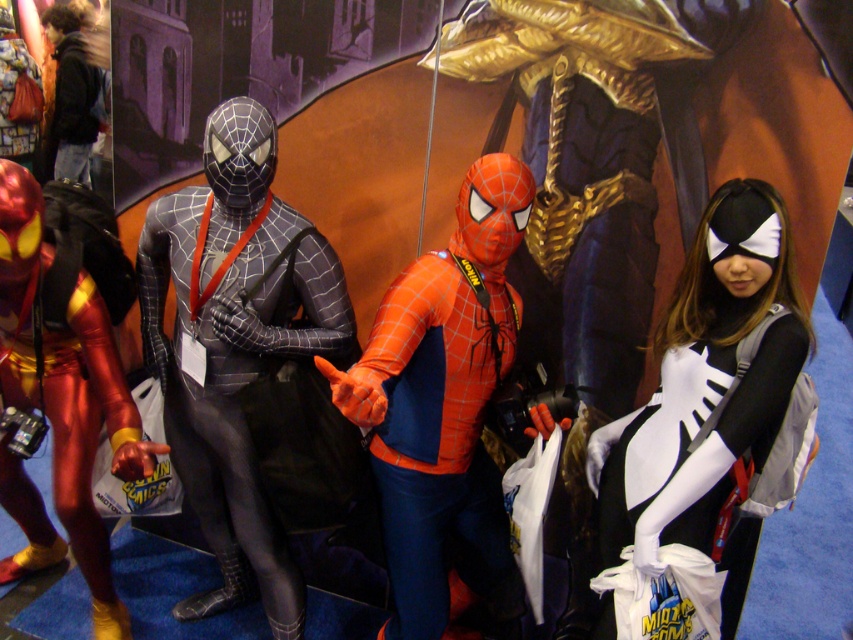
Question: Can you confirm if matte black suit at center is positioned above shiny orange fabric spider-man costume at center?

Choices:
 (A) yes
 (B) no

Answer: (A)

Question: Estimate the real-world distances between objects in this image. Which object is closer to the matte black suit at center?

Choices:
 (A) shiny metallic suit at left
 (B) matte black jacket at upper left
 (C) shiny orange fabric spider-man costume at center

Answer: (A)

Question: Which is farther from the matte black suit at center?

Choices:
 (A) shiny orange fabric spider-man costume at center
 (B) matte black jacket at upper left
 (C) shiny metallic suit at left
 (D) white matte spider suit at right

Answer: (B)

Question: Among these points, which one is nearest to the camera?

Choices:
 (A) [103, 321]
 (B) [666, 449]

Answer: (B)

Question: Can you confirm if shiny orange fabric spider-man costume at center is positioned to the right of matte black jacket at upper left?

Choices:
 (A) yes
 (B) no

Answer: (A)

Question: Does shiny orange fabric spider-man costume at center appear on the right side of white matte spider suit at right?

Choices:
 (A) no
 (B) yes

Answer: (A)